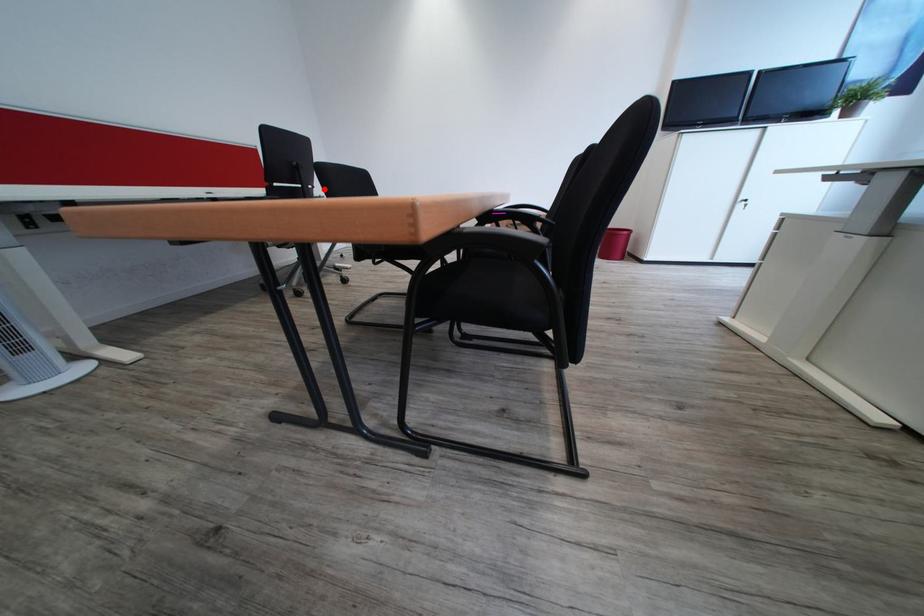
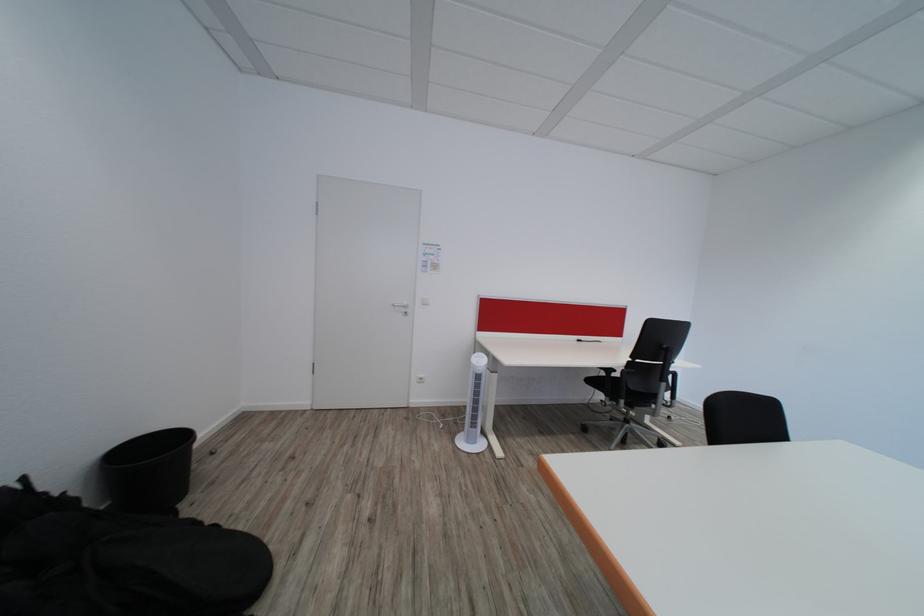
The point at the highlighted location is marked in the first image. Where is the corresponding point in the second image?

(684, 365)